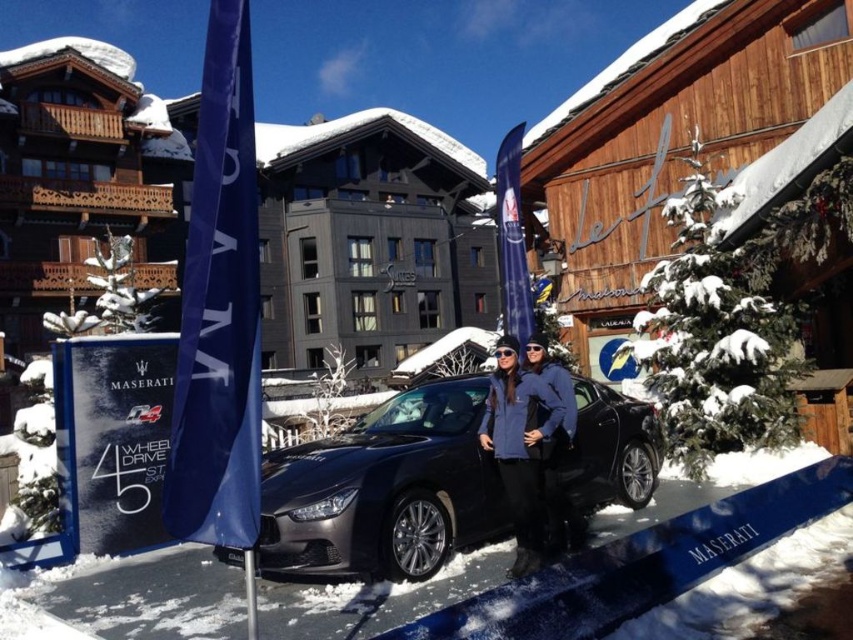
Is blue fabric jacket at center shorter than blue fabric flag at center?

Yes, blue fabric jacket at center is shorter than blue fabric flag at center.

Who is higher up, blue fabric jacket at center or blue fabric flag at center?

Positioned higher is blue fabric flag at center.

Who is more forward, (523, 515) or (508, 276)?

Point (523, 515) is more forward.

Locate an element on the screen. Image resolution: width=853 pixels, height=640 pixels. blue fabric jacket at center is located at coordinates (521, 448).

Is blue fabric flag at left to the left of blue fabric flag at center from the viewer's perspective?

Indeed, blue fabric flag at left is positioned on the left side of blue fabric flag at center.

This screenshot has width=853, height=640. What do you see at coordinates (219, 308) in the screenshot?
I see `blue fabric flag at left` at bounding box center [219, 308].

Where is `blue fabric flag at left`? This screenshot has height=640, width=853. blue fabric flag at left is located at coordinates (219, 308).

Image resolution: width=853 pixels, height=640 pixels. Identify the location of blue fabric flag at left. (219, 308).

Based on the photo, does satin black car at center have a smaller size compared to blue fabric jacket at center?

Actually, satin black car at center might be larger than blue fabric jacket at center.

Is satin black car at center further to camera compared to blue fabric jacket at center?

No, satin black car at center is in front of blue fabric jacket at center.

Does point (581, 422) come farther from viewer compared to point (512, 467)?

Yes, point (581, 422) is farther from viewer.

This screenshot has width=853, height=640. In order to click on satin black car at center in this screenshot , I will do `click(386, 490)`.